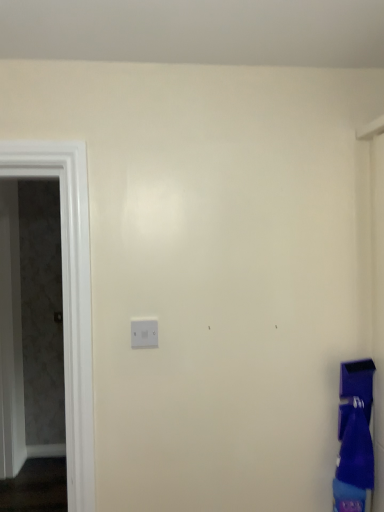
Question: Is matte gray screen door at left wider or thinner than matte blue laundry at lower right?

Choices:
 (A) thin
 (B) wide

Answer: (A)

Question: Is matte gray screen door at left bigger or smaller than matte blue laundry at lower right?

Choices:
 (A) big
 (B) small

Answer: (A)

Question: From a real-world perspective, is matte gray screen door at left physically located above or below matte blue laundry at lower right?

Choices:
 (A) below
 (B) above

Answer: (B)

Question: Is point (342, 386) closer or farther from the camera than point (89, 331)?

Choices:
 (A) closer
 (B) farther

Answer: (B)

Question: From the image's perspective, relative to matte gray screen door at left, is matte blue laundry at lower right above or below?

Choices:
 (A) below
 (B) above

Answer: (A)

Question: Relative to matte gray screen door at left, is matte blue laundry at lower right in front or behind?

Choices:
 (A) front
 (B) behind

Answer: (A)

Question: Is matte blue laundry at lower right to the left or to the right of matte gray screen door at left in the image?

Choices:
 (A) right
 (B) left

Answer: (A)